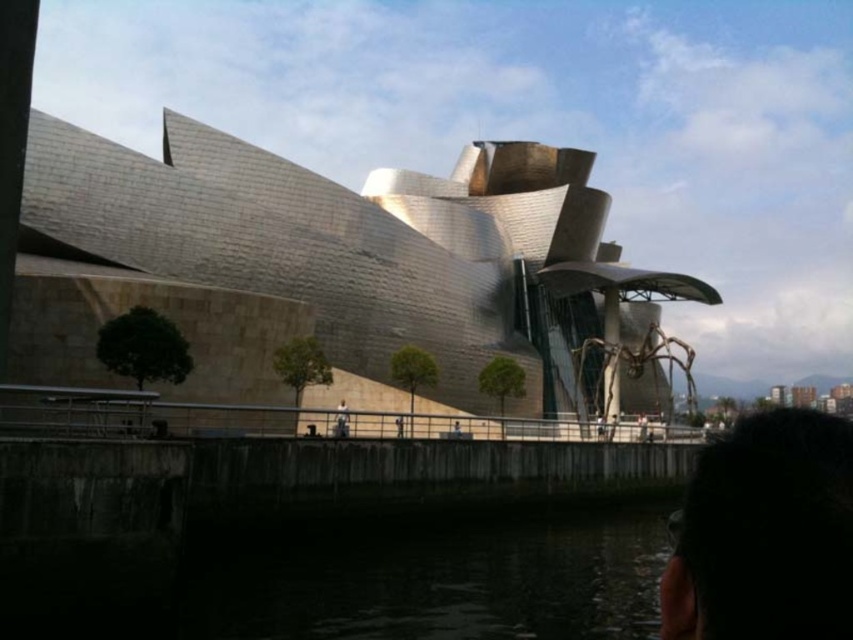
Can you confirm if dark hair at lower right is positioned below dark hair at center?

Yes, dark hair at lower right is below dark hair at center.

Which is in front, point (821, 486) or point (341, 412)?

Point (821, 486) is in front.

Where is `dark hair at lower right`? The image size is (853, 640). dark hair at lower right is located at coordinates tap(764, 532).

Which is more to the left, metallic silver building at center or dark hair at center?

dark hair at center

Is point (39, 346) positioned before point (346, 426)?

Yes, point (39, 346) is in front of point (346, 426).

Who is more forward, (364, 291) or (347, 426)?

Point (347, 426) is in front.

The image size is (853, 640). What are the coordinates of `metallic silver building at center` in the screenshot? It's located at (339, 275).

Does dark water at lower center have a lesser height compared to dark hair at lower right?

Correct, dark water at lower center is not as tall as dark hair at lower right.

Who is shorter, dark water at lower center or dark hair at lower right?

dark water at lower center

Find the location of a particular element. Image resolution: width=853 pixels, height=640 pixels. dark water at lower center is located at coordinates (370, 582).